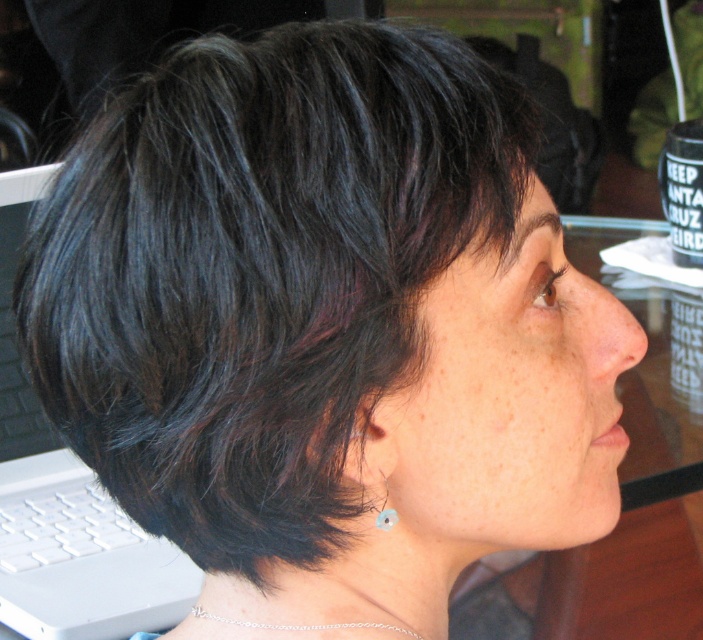
You are taking a photo of the person in the scene. You want to focus on the point that is closer to the camera. Which point should you choose between point (13, 326) and point (375, 524)?

Point (375, 524) is closer to the camera than point (13, 326), so you should choose point (375, 524) to focus on.

You are a photographer taking a portrait of the person. You need to ensure that both the white plastic laptop at left and the silver chain necklace at lower center are clearly visible in the frame. Which object should you focus on first to ensure both are in focus?

The white plastic laptop at left is positioned on the left side of silver chain necklace at lower center. To ensure both are in focus, you should focus on the silver chain necklace at lower center first since it is closer to the camera, allowing the laptop to be within the depth of field.

You are trying to locate the white plastic laptop at left in the image. According to the coordinates provided, where exactly should you look?

The white plastic laptop at left is located at point (65, 500).